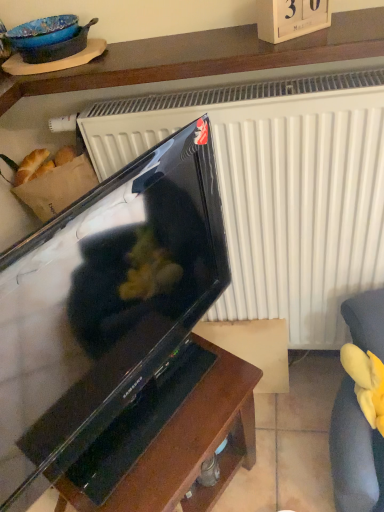
Question: Visually, is wooden shelf at upper center positioned to the left or to the right of brown wood table at center?

Choices:
 (A) left
 (B) right

Answer: (B)

Question: From a real-world perspective, is wooden shelf at upper center physically located above or below brown wood table at center?

Choices:
 (A) below
 (B) above

Answer: (B)

Question: Based on their relative distances, which object is farther from the yellow plush toy at lower right?

Choices:
 (A) brown wood table at center
 (B) wooden shelf at upper center
 (C) black glossy television at center

Answer: (B)

Question: Estimate the real-world distances between objects in this image. Which object is closer to the black glossy television at center?

Choices:
 (A) yellow plush toy at lower right
 (B) brown wood table at center
 (C) wooden shelf at upper center

Answer: (B)